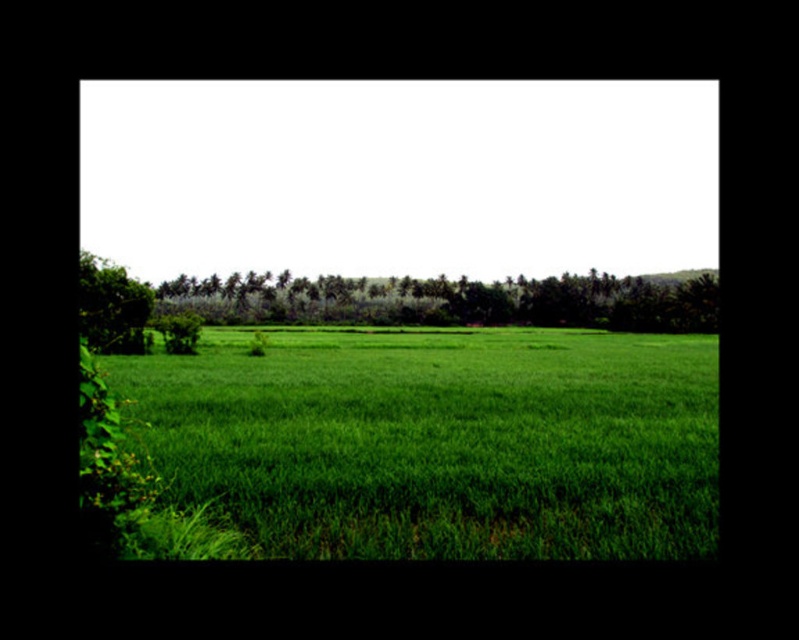
Question: Which point is closer to the camera?

Choices:
 (A) (249, 486)
 (B) (621, 278)

Answer: (A)

Question: Does green leafy trees at center appear on the right side of green leafy tree at left?

Choices:
 (A) no
 (B) yes

Answer: (B)

Question: Which point is closer to the camera taking this photo?

Choices:
 (A) (404, 556)
 (B) (686, 278)

Answer: (A)

Question: Can you confirm if green leafy trees at center is positioned to the left of green leafy tree at left?

Choices:
 (A) yes
 (B) no

Answer: (B)

Question: Considering the relative positions of green grassy field at center and green leafy trees at center in the image provided, where is green grassy field at center located with respect to green leafy trees at center?

Choices:
 (A) right
 (B) left

Answer: (A)

Question: Which object is farther from the camera taking this photo?

Choices:
 (A) green grassy field at center
 (B) green leafy trees at center

Answer: (B)